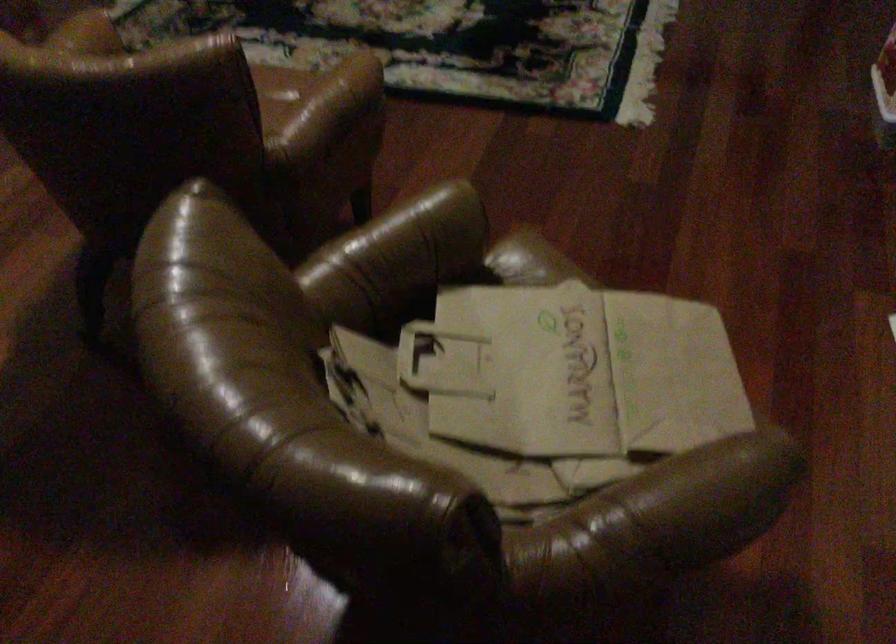
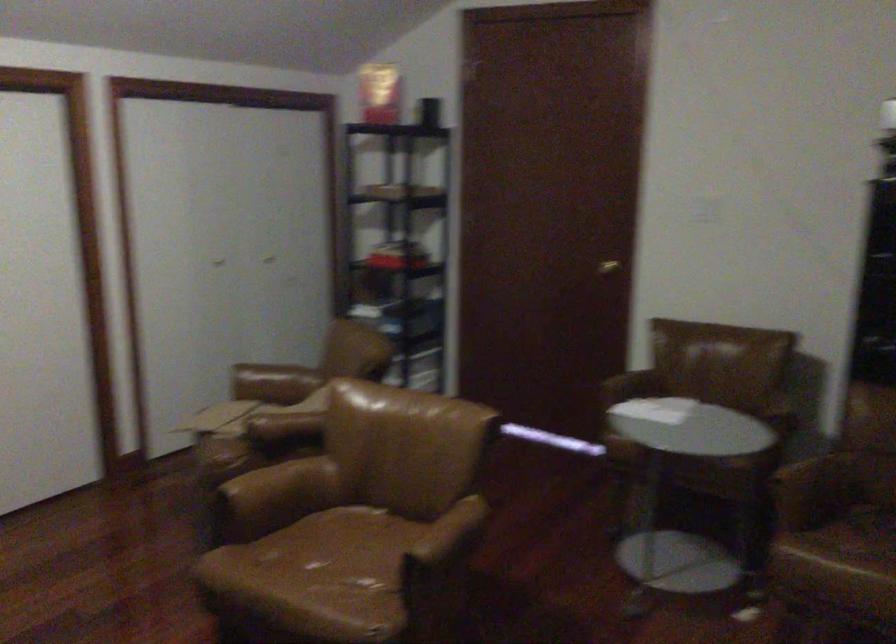
In the second image, find the point that corresponds to (392,251) in the first image.

(283, 426)